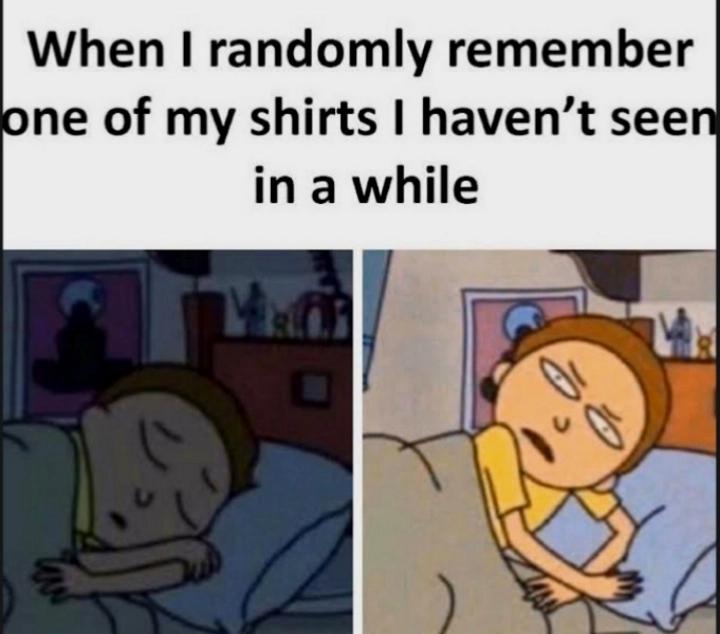
Locate an element on the screen. The height and width of the screenshot is (634, 720). pillow is located at coordinates (680, 489), (302, 496).